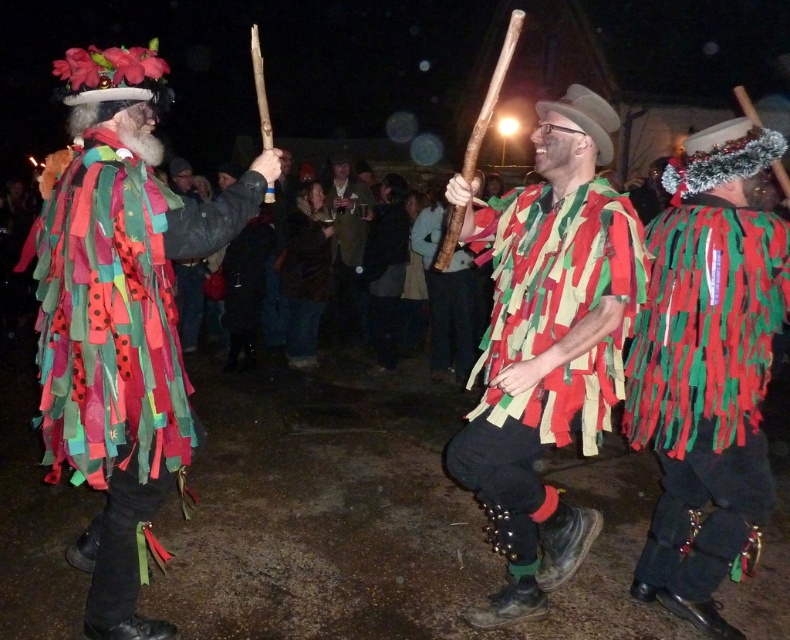
Question: Is multicolored fabric costume at left bigger than velvet brown vest at center?

Choices:
 (A) no
 (B) yes

Answer: (B)

Question: Does velvet brown vest at center appear under dark brown leather jacket at center?

Choices:
 (A) no
 (B) yes

Answer: (B)

Question: Among these objects, which one is farthest from the camera?

Choices:
 (A) matte green and red fabric at center
 (B) velvet brown vest at center
 (C) red-green fabric strips at center

Answer: (B)

Question: Is multicolored fabric costume at left to the right of velvet brown vest at center from the viewer's perspective?

Choices:
 (A) no
 (B) yes

Answer: (A)

Question: Which of the following is the closest to the observer?

Choices:
 (A) (324, 196)
 (B) (311, 291)
 (C) (138, 632)
 (D) (553, 573)

Answer: (C)

Question: Which is nearer to the velvet brown vest at center?

Choices:
 (A) red-green fabric strips at center
 (B) multicolored fabric costume at left
 (C) dark brown leather jacket at center
 (D) matte green and red fabric at center

Answer: (C)